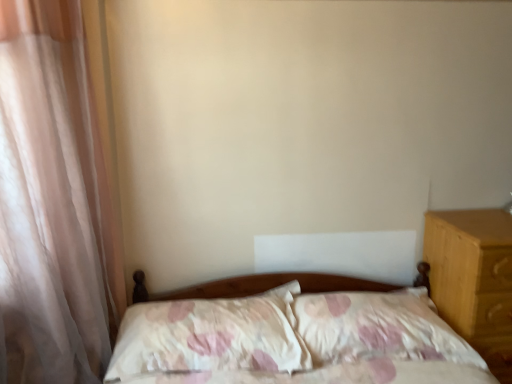
Question: From a real-world perspective, is sheer white curtain at left under fluffy white pillow at center, arranged as the second pillow when viewed from the left?

Choices:
 (A) no
 (B) yes

Answer: (A)

Question: Considering the relative positions of sheer white curtain at left and fluffy white pillow at center, arranged as the second pillow when viewed from the left, in the image provided, is sheer white curtain at left behind fluffy white pillow at center, arranged as the second pillow when viewed from the left,?

Choices:
 (A) no
 (B) yes

Answer: (A)

Question: Does sheer white curtain at left have a lesser width compared to fluffy white pillow at center, arranged as the second pillow when viewed from the left?

Choices:
 (A) yes
 (B) no

Answer: (A)

Question: Considering the relative sizes of sheer white curtain at left and fluffy white pillow at center, placed as the 1th pillow when sorted from right to left, in the image provided, is sheer white curtain at left wider than fluffy white pillow at center, placed as the 1th pillow when sorted from right to left,?

Choices:
 (A) yes
 (B) no

Answer: (B)

Question: Would you say fluffy white pillow at center, arranged as the second pillow when viewed from the left, is part of sheer white curtain at left's contents?

Choices:
 (A) no
 (B) yes

Answer: (A)

Question: Considering the positions of point (243, 319) and point (471, 251), is point (243, 319) closer or farther from the camera than point (471, 251)?

Choices:
 (A) farther
 (B) closer

Answer: (A)

Question: Visually, is fluffy white pillow at center, which ranks as the second pillow in right-to-left order, positioned to the left or to the right of light brown wood at right?

Choices:
 (A) left
 (B) right

Answer: (A)

Question: Is fluffy white pillow at center, which is the 1th pillow in left-to-right order, inside the boundaries of light brown wood at right, or outside?

Choices:
 (A) outside
 (B) inside

Answer: (A)

Question: Based on their sizes in the image, would you say fluffy white pillow at center, which ranks as the second pillow in right-to-left order, is bigger or smaller than light brown wood at right?

Choices:
 (A) big
 (B) small

Answer: (B)

Question: Choose the correct answer: Is fluffy white pillow at center, which is the 1th pillow in left-to-right order, inside sheer white curtain at left or outside it?

Choices:
 (A) inside
 (B) outside

Answer: (B)

Question: Does point (229, 362) appear closer or farther from the camera than point (93, 355)?

Choices:
 (A) closer
 (B) farther

Answer: (A)

Question: Looking at the image, does fluffy white pillow at center, which is the 1th pillow in left-to-right order, seem bigger or smaller compared to sheer white curtain at left?

Choices:
 (A) small
 (B) big

Answer: (B)

Question: From the image's perspective, is fluffy white pillow at center, which is the 1th pillow in left-to-right order, above or below sheer white curtain at left?

Choices:
 (A) below
 (B) above

Answer: (A)

Question: Is fluffy white pillow at center, placed as the 1th pillow when sorted from right to left, bigger or smaller than fluffy white pillow at center, which ranks as the second pillow in right-to-left order?

Choices:
 (A) big
 (B) small

Answer: (A)

Question: Does point pyautogui.click(x=442, y=352) appear closer or farther from the camera than point pyautogui.click(x=150, y=314)?

Choices:
 (A) closer
 (B) farther

Answer: (A)